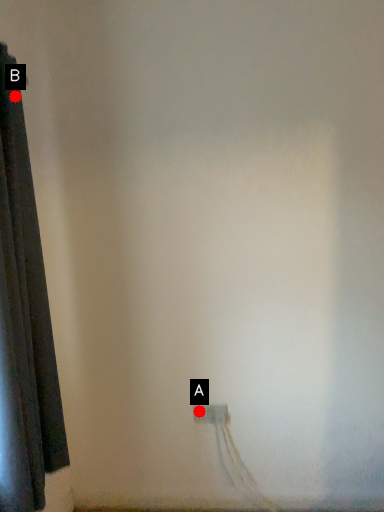
Question: Two points are circled on the image, labeled by A and B beside each circle. Which of the following is the closest to the observer?

Choices:
 (A) A is closer
 (B) B is closer

Answer: (B)